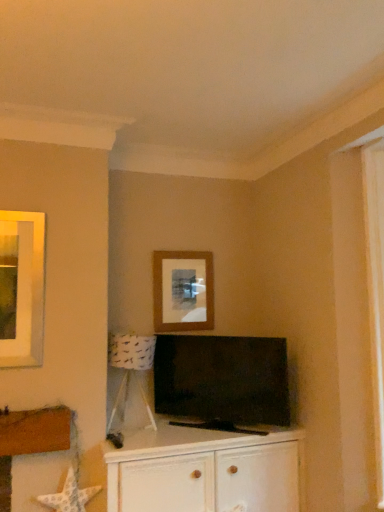
Question: Considering the relative positions of matte brown picture frame at center and white wood cabinet at center in the image provided, is matte brown picture frame at center to the left or to the right of white wood cabinet at center?

Choices:
 (A) right
 (B) left

Answer: (B)

Question: Looking at the image, does matte brown picture frame at center seem bigger or smaller compared to white wood cabinet at center?

Choices:
 (A) small
 (B) big

Answer: (A)

Question: Considering the real-world distances, which object is closest to the white wood cabinet at center?

Choices:
 (A) matte black tv at center
 (B) white paper lampshade at lower left
 (C) matte brown picture frame at center

Answer: (A)

Question: Estimate the real-world distances between objects in this image. Which object is farther from the matte brown picture frame at center?

Choices:
 (A) matte black tv at center
 (B) white paper lampshade at lower left
 (C) white wood cabinet at center

Answer: (C)